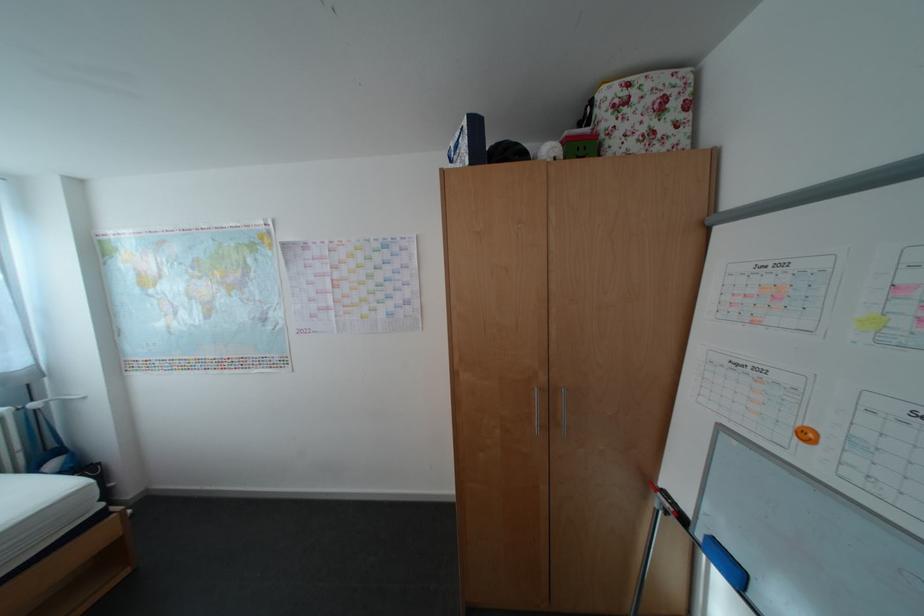
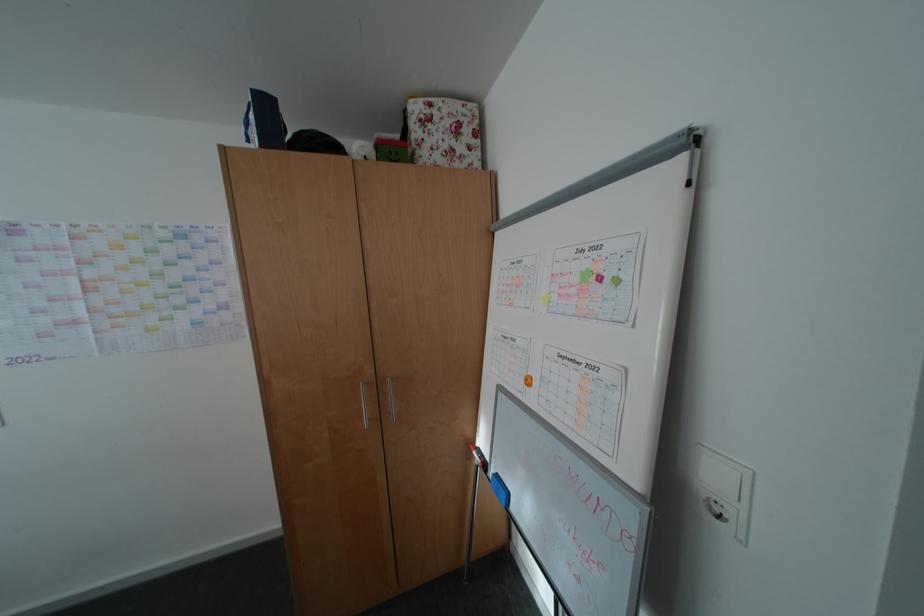
In the second image, find the point that corresponds to the point at 628,84 in the first image.

(433, 102)